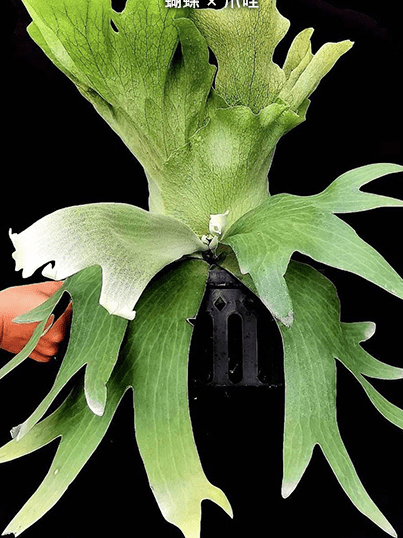
Locate an element on the screen. gray pot holding plant is located at coordinates (222, 278), (234, 305), (251, 364), (221, 350).